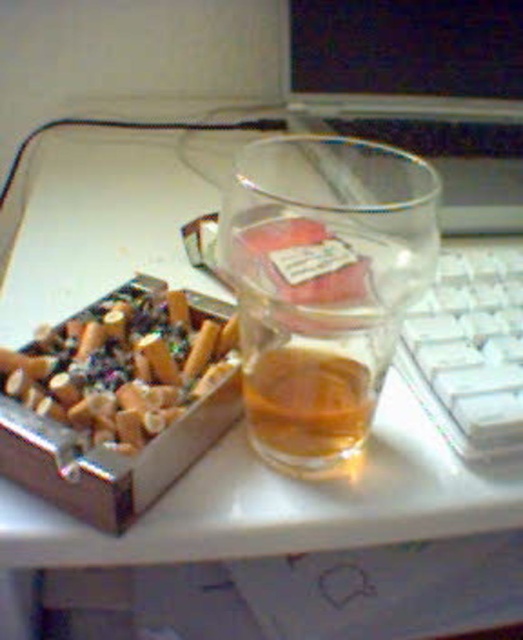
How much distance is there between transparent glass at center and white plastic keyboard at right?

They are 3.60 inches apart.

Between point (248, 157) and point (520, 332), which one is positioned in front?

Point (248, 157) is more forward.

Is point (272, 188) less distant than point (495, 433)?

No.

The height and width of the screenshot is (640, 523). I want to click on transparent glass at center, so (323, 284).

Between transparent glass at center and metallic ashtray at left, which one has less height?

Standing shorter between the two is metallic ashtray at left.

Is point (289, 234) positioned before point (123, 477)?

That is True.

Which is behind, point (369, 352) or point (29, 488)?

The point (29, 488) is behind.

Locate an element on the screen. The image size is (523, 640). transparent glass at center is located at coordinates (323, 284).

Does metallic ashtray at left appear over translucent glass at center?

Actually, metallic ashtray at left is below translucent glass at center.

Identify the location of metallic ashtray at left. The width and height of the screenshot is (523, 640). (112, 460).

Find the location of a particular element. The width and height of the screenshot is (523, 640). metallic ashtray at left is located at coordinates (112, 460).